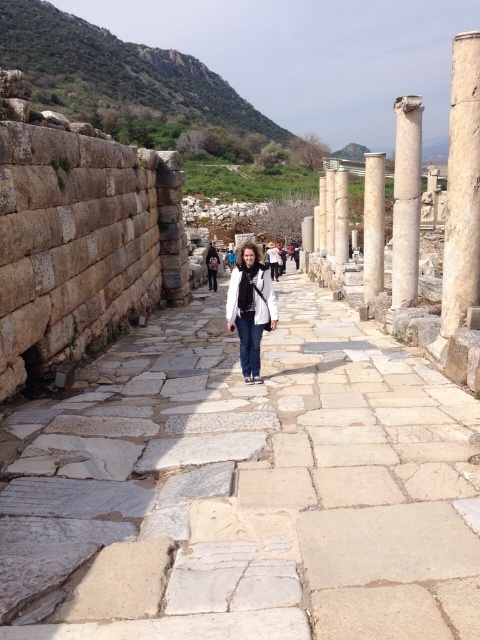
You are standing at the archaeological site and want to take a photo of the white marble column at right. If your camera has a maximum zoom range of 30 meters, will you be able to capture the column clearly without moving closer?

The white marble column at right is 41.02 meters away from the camera, which exceeds the maximum zoom range of 30 meters. Therefore, you won not be able to capture the column clearly without moving closer.